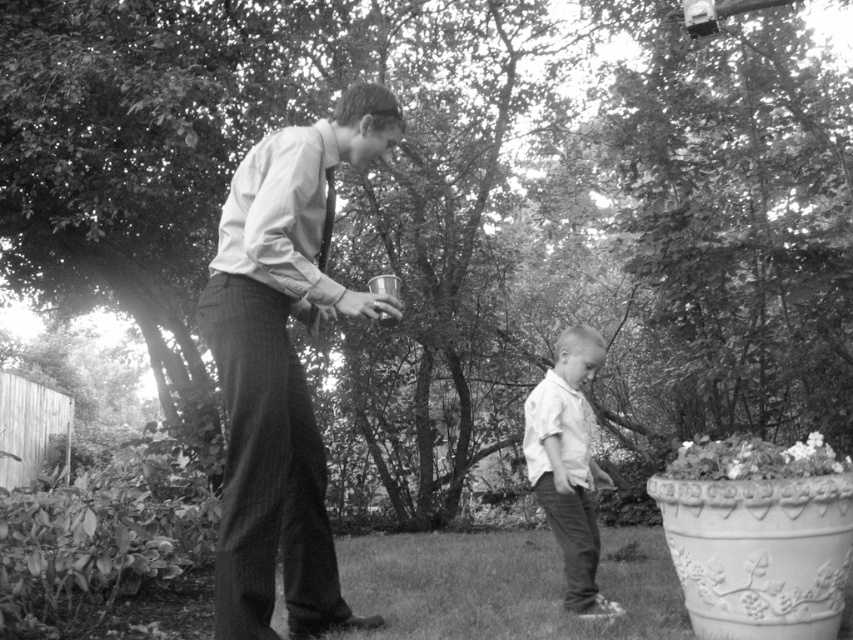
In the scene shown: Can you confirm if matte white shirt at center is positioned below white smooth shirt at center?

No, matte white shirt at center is not below white smooth shirt at center.

Can you confirm if matte white shirt at center is positioned to the left of white smooth shirt at center?

Indeed, matte white shirt at center is positioned on the left side of white smooth shirt at center.

Is point (265, 221) behind point (560, 374)?

No, (265, 221) is in front of (560, 374).

At what (x,y) coordinates should I click in order to perform the action: click on matte white shirt at center. Please return your answer as a coordinate pair (x, y). This screenshot has width=853, height=640. Looking at the image, I should click on (282, 365).